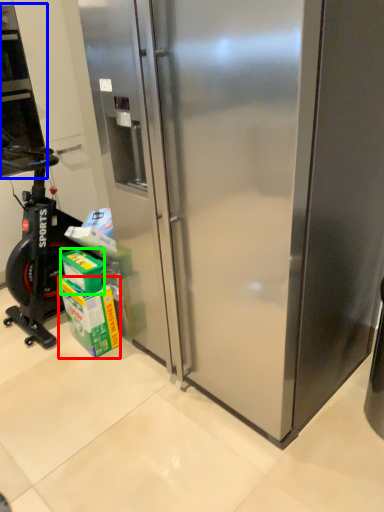
Question: Considering the real-world distances, which object is farthest from carton (highlighted by a red box)? home appliance (highlighted by a blue box) or box (highlighted by a green box)?

Choices:
 (A) home appliance
 (B) box

Answer: (A)